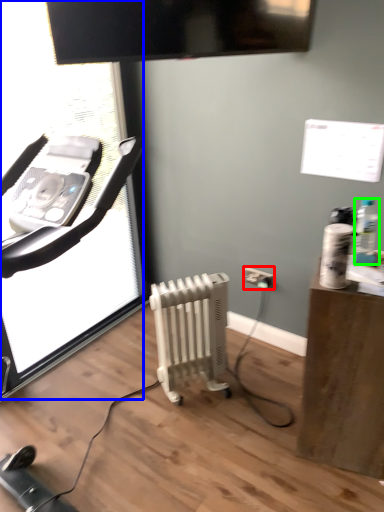
Question: Which object is positioned farthest from electric outlet (highlighted by a red box)? Select from screen door (highlighted by a blue box) and bottle (highlighted by a green box).

Choices:
 (A) screen door
 (B) bottle

Answer: (A)